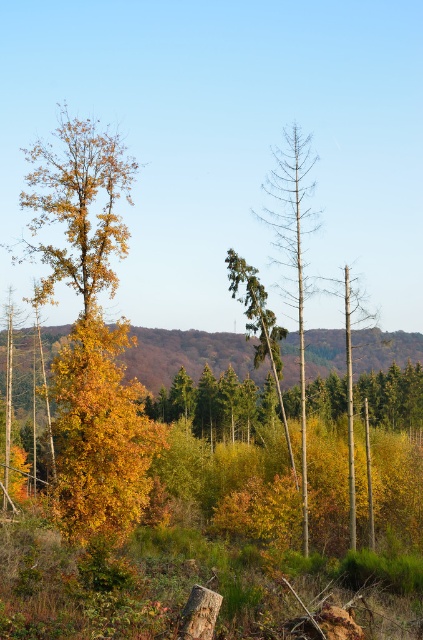
You are standing in the autumn landscape and want to take a photo of both the golden wood tree at left and the smooth brown tree trunk at center. Which tree should you focus on first to ensure both are in the frame?

Answer: You should focus on the golden wood tree at left first because it is closer to the viewer than the smooth brown tree trunk at center, so adjusting the camera to include both would require starting with the closer one.

From the picture: You are an artist planning to paint this autumn scene. You want to emphasize the golden wood tree at left and the bare wood tree at center. Considering their sizes, which tree should you paint larger on your canvas?

The golden wood tree at left should be painted larger than the bare wood tree at center because it is described as larger in size.